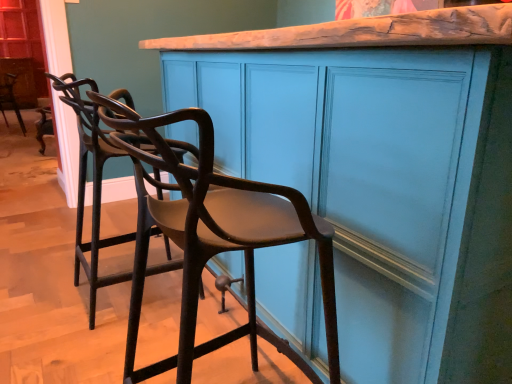
Locate an element on the screen. This screenshot has height=384, width=512. brown wood chair at center, arranged as the first chair when viewed from the right is located at coordinates (212, 234).

Image resolution: width=512 pixels, height=384 pixels. Describe the element at coordinates (212, 234) in the screenshot. I see `brown wood chair at center, arranged as the first chair when viewed from the right` at that location.

This screenshot has height=384, width=512. What do you see at coordinates (10, 99) in the screenshot?
I see `metallic dark brown chair at left, which ranks as the third chair in right-to-left order` at bounding box center [10, 99].

Where is `brown wood chair at center, positioned as the 3th chair in back-to-front order`? This screenshot has height=384, width=512. brown wood chair at center, positioned as the 3th chair in back-to-front order is located at coordinates (212, 234).

Between brown wood chair at center, positioned as the 3th chair in left-to-right order, and matte black chair at left, placed as the second chair when sorted from right to left, which one appears on the left side from the viewer's perspective?

matte black chair at left, placed as the second chair when sorted from right to left.

Can you tell me how much brown wood chair at center, positioned as the 3th chair in left-to-right order, and matte black chair at left, placed as the second chair when sorted from right to left, differ in facing direction?

The angular difference between brown wood chair at center, positioned as the 3th chair in left-to-right order, and matte black chair at left, placed as the second chair when sorted from right to left, is 0.00364 degrees.

Is brown wood chair at center, arranged as the first chair when viewed from the front, not close to matte black chair at left, which is counted as the second chair, starting from the left?

No, brown wood chair at center, arranged as the first chair when viewed from the front, is not far from matte black chair at left, which is counted as the second chair, starting from the left.

Is brown wood chair at center, positioned as the 3th chair in back-to-front order, surrounding matte black chair at left, placed as the second chair when sorted from right to left?

No, matte black chair at left, placed as the second chair when sorted from right to left, is located outside of brown wood chair at center, positioned as the 3th chair in back-to-front order.

Which is more to the left, matte teal cabinet at center or metallic dark brown chair at left, which is the 1th chair from back to front?

From the viewer's perspective, metallic dark brown chair at left, which is the 1th chair from back to front, appears more on the left side.

Would you consider matte teal cabinet at center to be distant from metallic dark brown chair at left, which is the 1th chair from back to front?

matte teal cabinet at center is positioned a significant distance from metallic dark brown chair at left, which is the 1th chair from back to front.

Which of these two, matte teal cabinet at center or metallic dark brown chair at left, which is the 1th chair from back to front, is smaller?

metallic dark brown chair at left, which is the 1th chair from back to front.

Find the location of a particular element. chair that is the 2nd one when counting backward from the matte teal cabinet at center is located at coordinates (10, 99).

You are a GUI agent. You are given a task and a screenshot of the screen. Output one action in this format:
    pyautogui.click(x=<x>, y=<y>)
    Task: Click on the chair behind the matte black chair at left, arranged as the second chair when viewed from the front
    
    Given the screenshot: What is the action you would take?
    pyautogui.click(x=10, y=99)

Which object is positioned more to the right, matte black chair at left, which is counted as the second chair, starting from the left, or metallic dark brown chair at left, which ranks as the third chair in right-to-left order?

matte black chair at left, which is counted as the second chair, starting from the left.

Looking at their sizes, would you say matte black chair at left, placed as the 2th chair when sorted from back to front, is wider or thinner than metallic dark brown chair at left, marked as the 1th chair in a left-to-right arrangement?

In the image, matte black chair at left, placed as the 2th chair when sorted from back to front, appears to be wider than metallic dark brown chair at left, marked as the 1th chair in a left-to-right arrangement.

Does matte black chair at left, arranged as the second chair when viewed from the front, come in front of metallic dark brown chair at left, which appears as the third chair when viewed from the front?

That is True.

From the image's perspective, is matte teal cabinet at center located beneath matte black chair at left, arranged as the second chair when viewed from the front?

No.

Does matte teal cabinet at center appear on the left side of matte black chair at left, placed as the second chair when sorted from right to left?

No, matte teal cabinet at center is not to the left of matte black chair at left, placed as the second chair when sorted from right to left.

I want to click on the 1st chair positioned below the matte teal cabinet at center (from the image's perspective), so click(x=94, y=186).

Does matte teal cabinet at center have a lesser height compared to matte black chair at left, which is counted as the second chair, starting from the left?

No.

Locate an element on the screen. Image resolution: width=512 pixels, height=384 pixels. cabinetry behind the brown wood chair at center, arranged as the first chair when viewed from the front is located at coordinates (382, 171).

From the image's perspective, is matte teal cabinet at center on brown wood chair at center, arranged as the first chair when viewed from the front?

Indeed, from the image's perspective, matte teal cabinet at center is shown above brown wood chair at center, arranged as the first chair when viewed from the front.

Is matte teal cabinet at center in front of brown wood chair at center, arranged as the first chair when viewed from the right?

No, it is behind brown wood chair at center, arranged as the first chair when viewed from the right.

Between matte teal cabinet at center and brown wood chair at center, positioned as the 3th chair in left-to-right order, which one has more height?

matte teal cabinet at center is taller.

From the image's perspective, which is below, metallic dark brown chair at left, which appears as the third chair when viewed from the front, or brown wood chair at center, arranged as the first chair when viewed from the right?

From the image's view, brown wood chair at center, arranged as the first chair when viewed from the right, is below.

Could brown wood chair at center, positioned as the 3th chair in back-to-front order, be considered to be inside metallic dark brown chair at left, which appears as the third chair when viewed from the front?

No, brown wood chair at center, positioned as the 3th chair in back-to-front order, is not surrounded by metallic dark brown chair at left, which appears as the third chair when viewed from the front.

Which of these two, metallic dark brown chair at left, marked as the 1th chair in a left-to-right arrangement, or brown wood chair at center, positioned as the 3th chair in left-to-right order, is thinner?

metallic dark brown chair at left, marked as the 1th chair in a left-to-right arrangement, is thinner.

In terms of height, does metallic dark brown chair at left, which is the 1th chair from back to front, look taller or shorter compared to brown wood chair at center, positioned as the 3th chair in back-to-front order?

In the image, metallic dark brown chair at left, which is the 1th chair from back to front, appears to be shorter than brown wood chair at center, positioned as the 3th chair in back-to-front order.

Considering the sizes of brown wood chair at center, arranged as the first chair when viewed from the right, and metallic dark brown chair at left, marked as the 1th chair in a left-to-right arrangement, in the image, is brown wood chair at center, arranged as the first chair when viewed from the right, wider or thinner than metallic dark brown chair at left, marked as the 1th chair in a left-to-right arrangement,?

Considering their sizes, brown wood chair at center, arranged as the first chair when viewed from the right, looks broader than metallic dark brown chair at left, marked as the 1th chair in a left-to-right arrangement.

At what (x,y) coordinates should I click in order to perform the action: click on the 2nd chair directly beneath the brown wood chair at center, positioned as the 3th chair in left-to-right order (from a real-world perspective). Please return your answer as a coordinate pair (x, y). This screenshot has width=512, height=384. Looking at the image, I should click on (10, 99).

From the image's perspective, between brown wood chair at center, arranged as the first chair when viewed from the front, and metallic dark brown chair at left, which appears as the third chair when viewed from the front, who is located below?

brown wood chair at center, arranged as the first chair when viewed from the front, appears lower in the image.

This screenshot has width=512, height=384. I want to click on chair on the right of matte black chair at left, which is counted as the second chair, starting from the left, so click(212, 234).

Which chair is the 2nd one when counting from the back of the matte teal cabinet at center? Please provide its 2D coordinates.

[(10, 99)]

Looking at the image, which one is located further to metallic dark brown chair at left, which is the 1th chair from back to front, matte teal cabinet at center or brown wood chair at center, positioned as the 3th chair in left-to-right order?

matte teal cabinet at center lies further to metallic dark brown chair at left, which is the 1th chair from back to front, than the other object.

Looking at this image, when comparing their distances from matte black chair at left, arranged as the second chair when viewed from the front, does matte teal cabinet at center or brown wood chair at center, positioned as the 3th chair in left-to-right order, seem closer?

brown wood chair at center, positioned as the 3th chair in left-to-right order, is closer to matte black chair at left, arranged as the second chair when viewed from the front.

Looking at the image, which one is located closer to matte teal cabinet at center, brown wood chair at center, arranged as the first chair when viewed from the front, or matte black chair at left, arranged as the second chair when viewed from the front?

The object closer to matte teal cabinet at center is brown wood chair at center, arranged as the first chair when viewed from the front.

Considering their positions, is metallic dark brown chair at left, which ranks as the third chair in right-to-left order, positioned further to matte black chair at left, which is counted as the second chair, starting from the left, than brown wood chair at center, positioned as the 3th chair in left-to-right order?

metallic dark brown chair at left, which ranks as the third chair in right-to-left order, lies further to matte black chair at left, which is counted as the second chair, starting from the left, than the other object.

When comparing their distances from brown wood chair at center, positioned as the 3th chair in back-to-front order, does matte teal cabinet at center or matte black chair at left, placed as the 2th chair when sorted from back to front, seem further?

matte black chair at left, placed as the 2th chair when sorted from back to front, is positioned further to the anchor brown wood chair at center, positioned as the 3th chair in back-to-front order.

Which object lies further to the anchor point brown wood chair at center, positioned as the 3th chair in back-to-front order, matte teal cabinet at center or metallic dark brown chair at left, which appears as the third chair when viewed from the front?

metallic dark brown chair at left, which appears as the third chair when viewed from the front, lies further to brown wood chair at center, positioned as the 3th chair in back-to-front order, than the other object.

Looking at this image, when comparing their distances from metallic dark brown chair at left, which appears as the third chair when viewed from the front, does matte teal cabinet at center or matte black chair at left, arranged as the second chair when viewed from the front, seem further?

matte teal cabinet at center.

From the image, which object appears to be nearer to matte black chair at left, placed as the second chair when sorted from right to left, brown wood chair at center, arranged as the first chair when viewed from the front, or metallic dark brown chair at left, marked as the 1th chair in a left-to-right arrangement?

The object closer to matte black chair at left, placed as the second chair when sorted from right to left, is brown wood chair at center, arranged as the first chair when viewed from the front.

You are a GUI agent. You are given a task and a screenshot of the screen. Output one action in this format:
    pyautogui.click(x=<x>, y=<y>)
    Task: Click on the chair between brown wood chair at center, positioned as the 3th chair in back-to-front order, and metallic dark brown chair at left, which appears as the third chair when viewed from the front, along the z-axis
    This screenshot has width=512, height=384.
    Given the screenshot: What is the action you would take?
    pyautogui.click(x=94, y=186)

Identify the location of cabinetry located between brown wood chair at center, positioned as the 3th chair in back-to-front order, and metallic dark brown chair at left, which is the 1th chair from back to front, in the depth direction. Image resolution: width=512 pixels, height=384 pixels. (382, 171).

Where is `cabinetry between brown wood chair at center, positioned as the 3th chair in left-to-right order, and matte black chair at left, placed as the second chair when sorted from right to left, in the front-back direction`? The width and height of the screenshot is (512, 384). cabinetry between brown wood chair at center, positioned as the 3th chair in left-to-right order, and matte black chair at left, placed as the second chair when sorted from right to left, in the front-back direction is located at coordinates (382, 171).

The width and height of the screenshot is (512, 384). I want to click on chair between matte teal cabinet at center and metallic dark brown chair at left, which ranks as the third chair in right-to-left order, in the front-back direction, so click(94, 186).